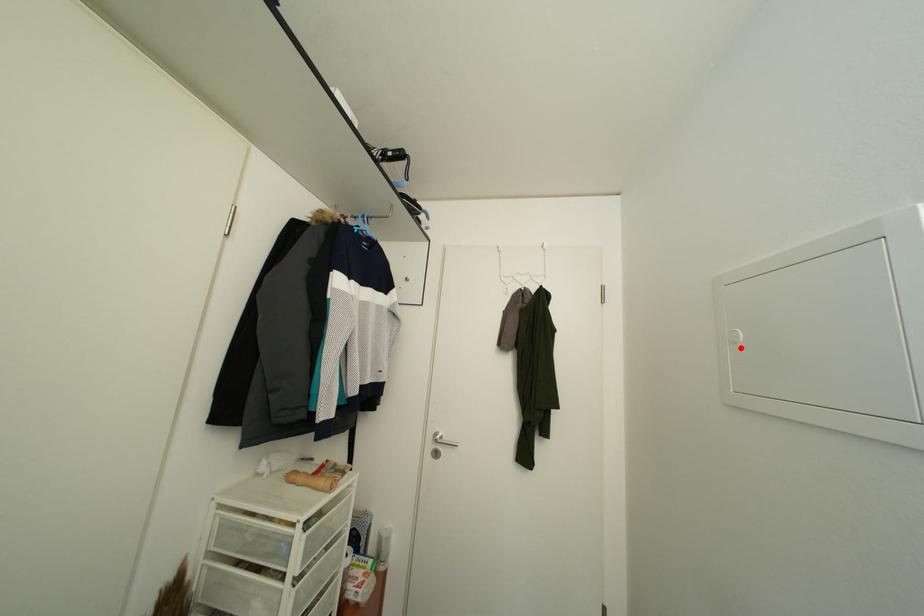
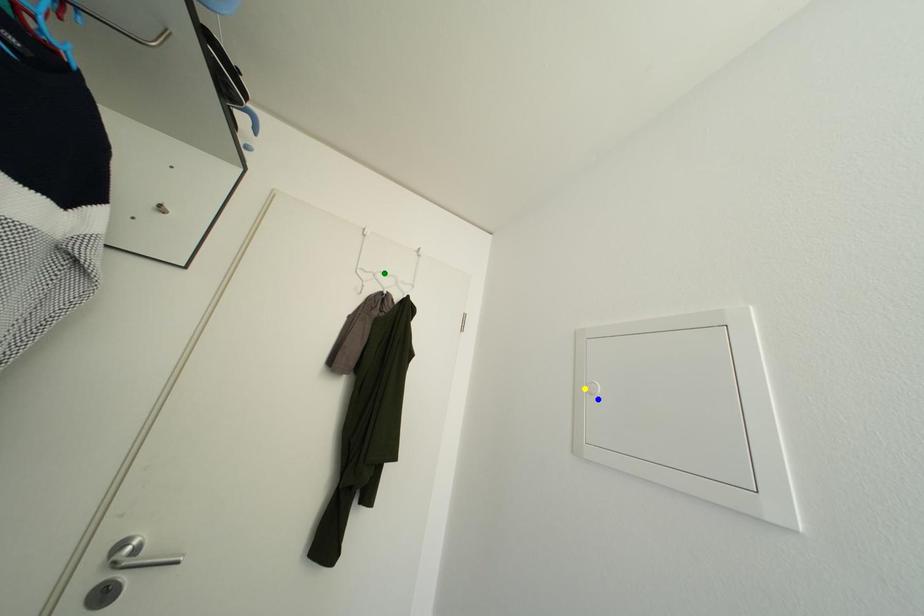
Question: I am providing you with two images of the same scene from different viewpoints. A red point is marked on the first image. You are given multiple points on the second image. Can you choose the point in image 2 that corresponds to the point in image 1?

Choices:
 (A) blue point
 (B) green point
 (C) yellow point

Answer: (A)